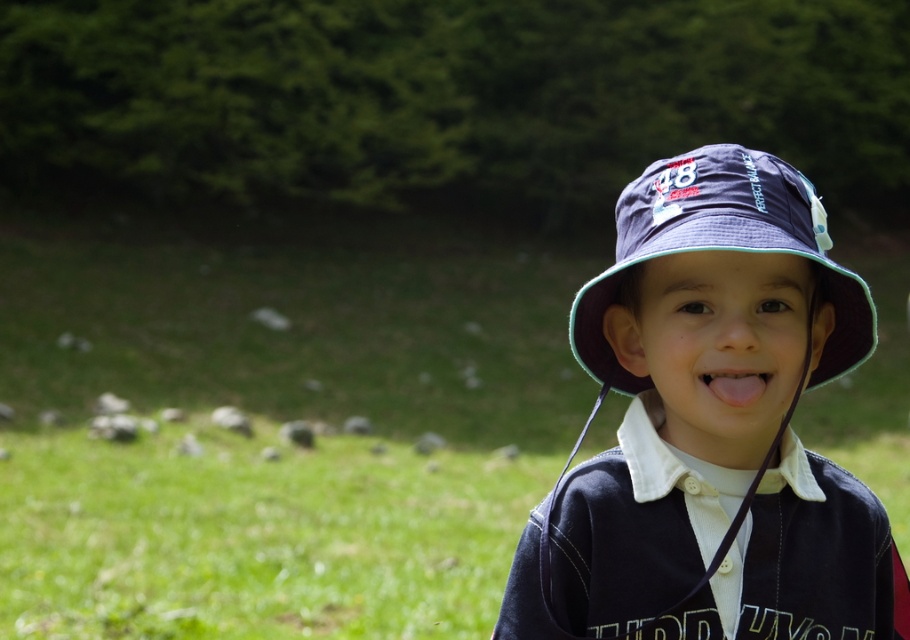
You are a photographer standing 1.5 meters away from the matte blue hat at center. Can you reach it without moving your feet?

The matte blue hat at center is 1.46 meters from the viewer, so yes, you can reach it without moving your feet since it is slightly closer than your 1.5 meter distance.

What is located at the coordinates point (275, 435) in the image?

The green grass at center is located at point (275, 435).

You are a photographer trying to capture the perfect shot of the navy blue fabric baseball hat at center. The camera you are using has a focus point at coordinates 0.4, 0.8. Will the focus point align with the hat?

The 2D location of navy blue fabric baseball hat at center is at point (721, 248). The camera focus point is at (728, 256). The coordinates are very close but not exactly the same. Therefore, the focus point will not perfectly align with the hat.